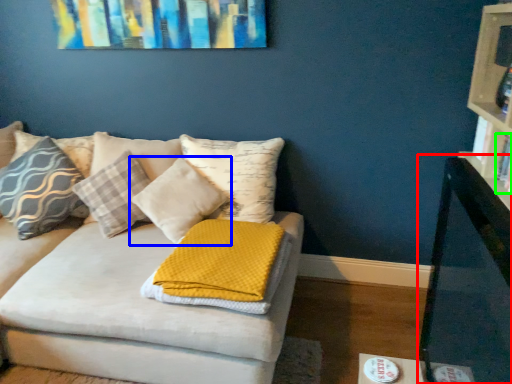
Question: Which is farther away from table (highlighted by a red box)? pillow (highlighted by a blue box) or book (highlighted by a green box)?

Choices:
 (A) pillow
 (B) book

Answer: (A)